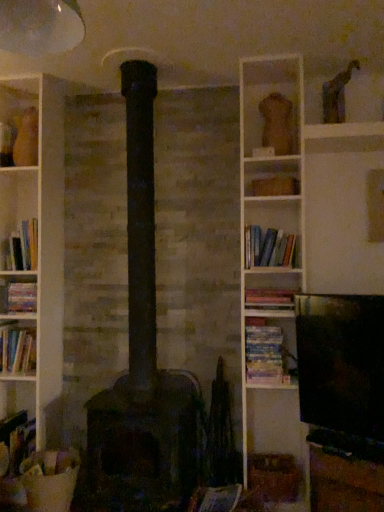
Question: Which direction should I rotate to look at wooden at center, which is counted as the 2th shelf, starting from the top?

Choices:
 (A) right
 (B) left

Answer: (A)

Question: Does wooden at center, the first shelf from the right, have a greater height compared to matte pink book at center, the third book from the bottom?

Choices:
 (A) no
 (B) yes

Answer: (B)

Question: Would you say matte pink book at center, marked as the 6th book in a left-to-right arrangement, is part of wooden at center, which is the first shelf in bottom-to-top order,'s contents?

Choices:
 (A) no
 (B) yes

Answer: (A)

Question: Does wooden at center, which is the first shelf in bottom-to-top order, have a greater width compared to matte pink book at center, positioned as the 4th book in top-to-bottom order?

Choices:
 (A) yes
 (B) no

Answer: (A)

Question: Is wooden at center, the first shelf in the front-to-back sequence, far away from matte pink book at center, marked as the first book in a right-to-left arrangement?

Choices:
 (A) yes
 (B) no

Answer: (B)

Question: Considering the relative sizes of wooden at center, the first shelf in the front-to-back sequence, and matte pink book at center, marked as the 6th book in a left-to-right arrangement, in the image provided, is wooden at center, the first shelf in the front-to-back sequence, shorter than matte pink book at center, marked as the 6th book in a left-to-right arrangement,?

Choices:
 (A) yes
 (B) no

Answer: (B)

Question: Considering the relative positions of wooden at center, the first shelf in the front-to-back sequence, and matte pink book at center, the third book from the bottom, in the image provided, is wooden at center, the first shelf in the front-to-back sequence, to the right of matte pink book at center, the third book from the bottom, from the viewer's perspective?

Choices:
 (A) yes
 (B) no

Answer: (A)

Question: From the image's perspective, is wooden at center, the first shelf in the front-to-back sequence, above dark gray stone stove at center?

Choices:
 (A) no
 (B) yes

Answer: (A)

Question: Is wooden at center, the first shelf from the right, not inside dark gray stone stove at center?

Choices:
 (A) yes
 (B) no

Answer: (A)

Question: Considering the relative sizes of wooden at center, which is the first shelf in bottom-to-top order, and dark gray stone stove at center in the image provided, is wooden at center, which is the first shelf in bottom-to-top order, smaller than dark gray stone stove at center?

Choices:
 (A) yes
 (B) no

Answer: (B)

Question: From the image's perspective, would you say wooden at center, marked as the second shelf in a left-to-right arrangement, is shown under dark gray stone stove at center?

Choices:
 (A) yes
 (B) no

Answer: (A)

Question: Considering the relative sizes of wooden at center, marked as the second shelf in a back-to-front arrangement, and dark gray stone stove at center in the image provided, is wooden at center, marked as the second shelf in a back-to-front arrangement, taller than dark gray stone stove at center?

Choices:
 (A) no
 (B) yes

Answer: (A)

Question: Are wooden at center, the first shelf from the right, and dark gray stone stove at center far apart?

Choices:
 (A) yes
 (B) no

Answer: (B)

Question: From a real-world perspective, is dark gray stone stove at center on top of hardcover book at left, which appears as the 3th book when viewed from the top?

Choices:
 (A) no
 (B) yes

Answer: (A)